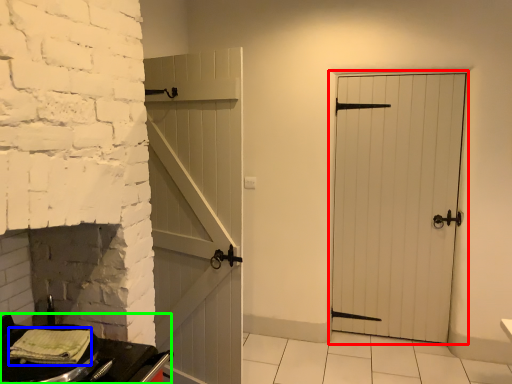
Question: Based on their relative distances, which object is nearer to door (highlighted by a red box)? Choose from material (highlighted by a blue box) and table (highlighted by a green box).

Choices:
 (A) material
 (B) table

Answer: (B)